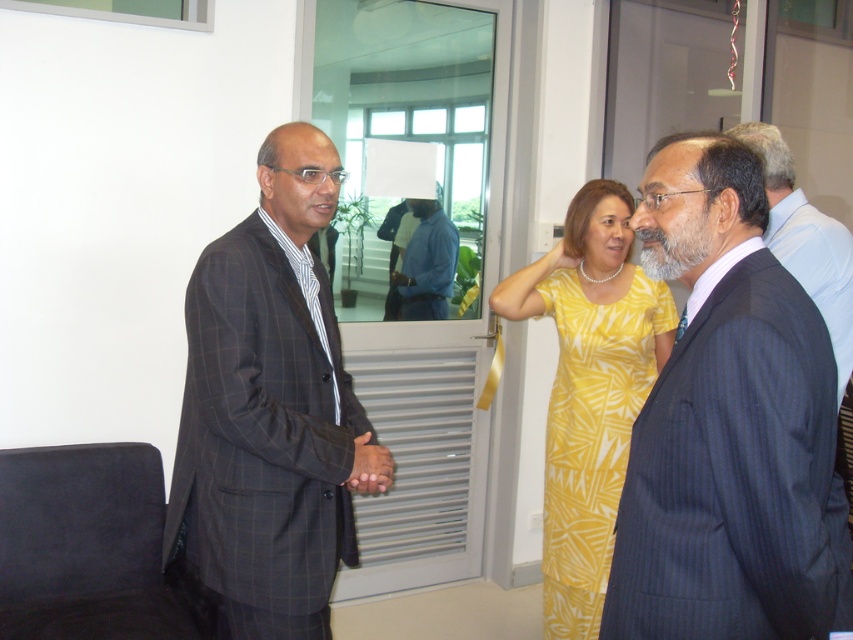
Is yellow printed dress at center above dark gray suit at center?

No.

Can you confirm if yellow printed dress at center is positioned to the left of dark gray suit at center?

Indeed, yellow printed dress at center is positioned on the left side of dark gray suit at center.

Does point (514, 278) come farther from viewer compared to point (846, 298)?

Yes.

The height and width of the screenshot is (640, 853). I want to click on yellow printed dress at center, so click(x=589, y=390).

Can you confirm if yellow printed dress at center is smaller than smooth skin hand at center?

Actually, yellow printed dress at center might be larger than smooth skin hand at center.

How much distance is there between yellow printed dress at center and smooth skin hand at center?

A distance of 30.78 inches exists between yellow printed dress at center and smooth skin hand at center.

Which is behind, point (585, 284) or point (352, 460)?

The point (585, 284) is more distant.

Find the location of a particular element. The width and height of the screenshot is (853, 640). yellow printed dress at center is located at coordinates (589, 390).

Is dark gray checkered suit at center thinner than dark gray suit at center?

Incorrect, dark gray checkered suit at center's width is not less than dark gray suit at center's.

Can you confirm if dark gray checkered suit at center is positioned above dark gray suit at center?

Actually, dark gray checkered suit at center is below dark gray suit at center.

Where is `dark gray checkered suit at center`? dark gray checkered suit at center is located at coordinates (265, 413).